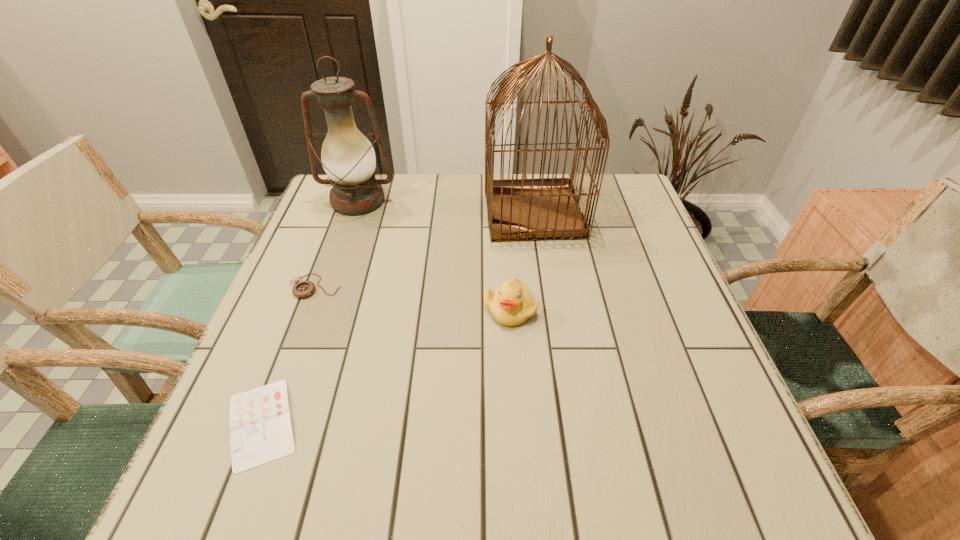
Image resolution: width=960 pixels, height=540 pixels. What are the coordinates of `vacant space located 0.400m on the right of the nearest object` in the screenshot? It's located at (533, 423).

I want to click on birdcage situated at the far edge, so click(x=523, y=209).

The width and height of the screenshot is (960, 540). Identify the location of oil lamp that is at the far edge. (347, 156).

The image size is (960, 540). I want to click on object at the near edge, so click(x=261, y=432).

Where is `oil lamp located at the left edge`? oil lamp located at the left edge is located at coordinates (347, 156).

Find the location of a particular element. The height and width of the screenshot is (540, 960). pocket watch situated at the left edge is located at coordinates (302, 289).

This screenshot has width=960, height=540. I want to click on diary at the left edge, so click(261, 432).

This screenshot has width=960, height=540. What are the coordinates of `object that is at the far left corner` in the screenshot? It's located at (347, 156).

Locate an element on the screen. The image size is (960, 540). object at the near left corner is located at coordinates (261, 432).

I want to click on vacant region at the far edge of the desktop, so click(402, 195).